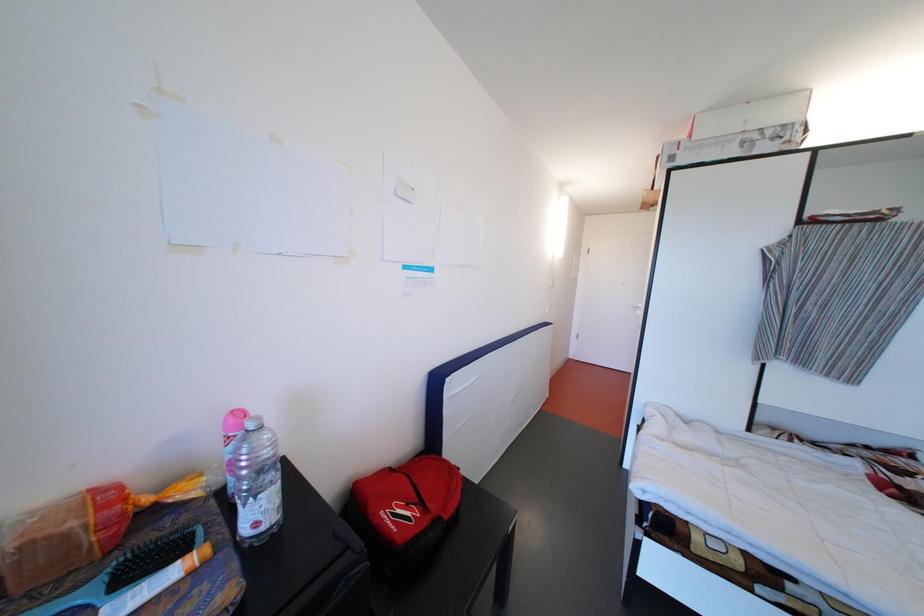
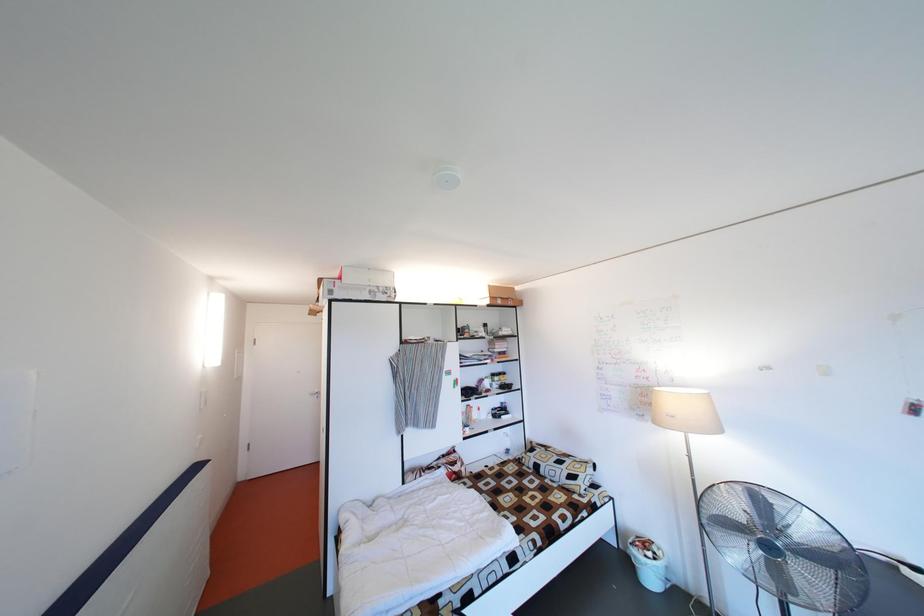
Question: Based on the continuous images, in which direction is the camera rotating? Reply with the corresponding letter.

Choices:
 (A) Left
 (B) Right
 (C) Up
 (D) Down

Answer: (B)